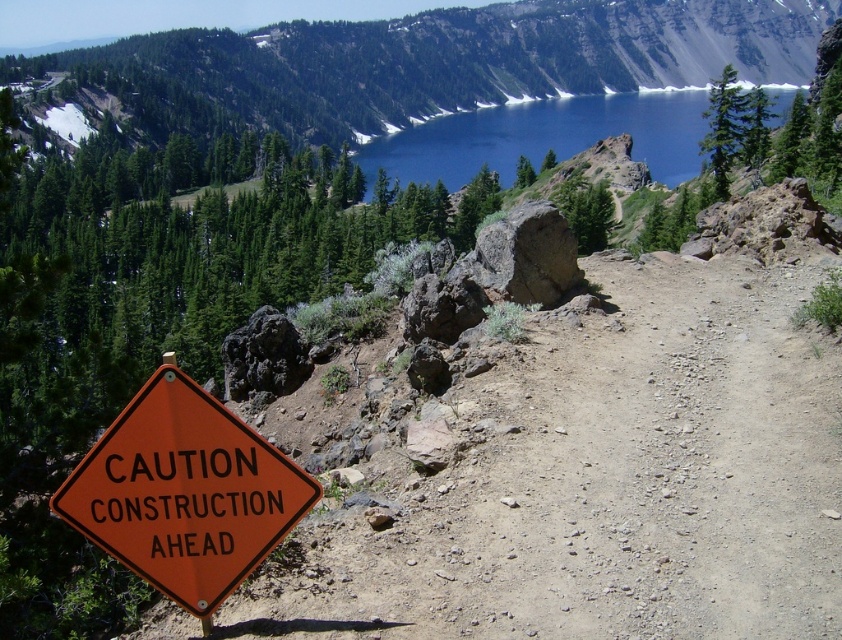
You are a hiker who just arrived at the trailhead. You see the orange plastic sign at lower left and the blue glassy lake at upper center. Which object is closer to you?

The orange plastic sign at lower left is closer to you because it is positioned in the foreground and is not as tall as the blue glassy lake at upper center, indicating it is nearer in the scene.

You are a hiker planning to take a photo of the orange plastic sign at lower left and the blue glassy lake at upper center. Which object will appear wider in the photo?

The blue glassy lake at upper center will appear wider in the photo because the orange plastic sign at lower left is narrower than the blue glassy lake at upper center.

You are standing at the point with coordinates point (781, 102) and want to walk to the orange diamond sign in the foreground. Which direction should you move relative to point (204, 538)?

You should move towards the direction of point (204, 538) because it is in front of point (781, 102), meaning it is closer to your current position at point (781, 102).